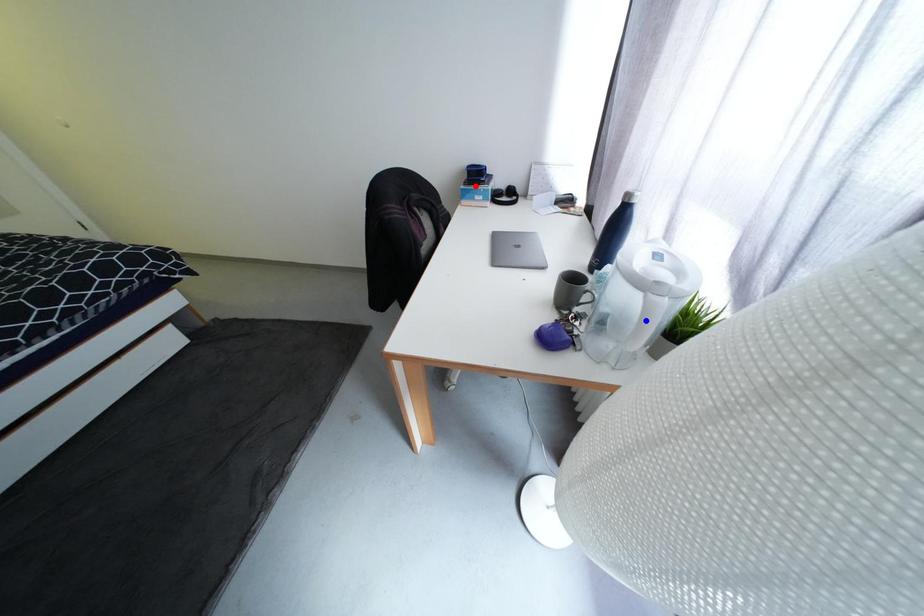
Question: In the image, two points are highlighted. Which point is nearer to the camera? Reply with the corresponding letter.

Choices:
 (A) blue point
 (B) red point

Answer: (A)